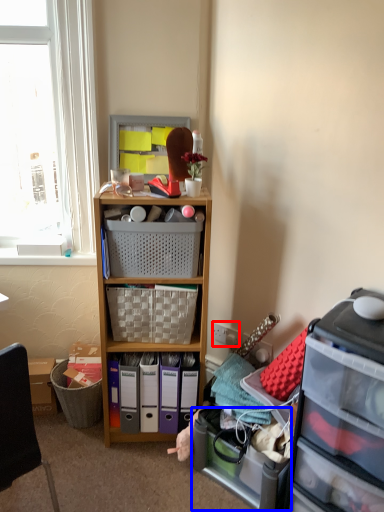
Question: Among these objects, which one is farthest to the camera, power outlet (highlighted by a red box) or storage box (highlighted by a blue box)?

Choices:
 (A) power outlet
 (B) storage box

Answer: (A)